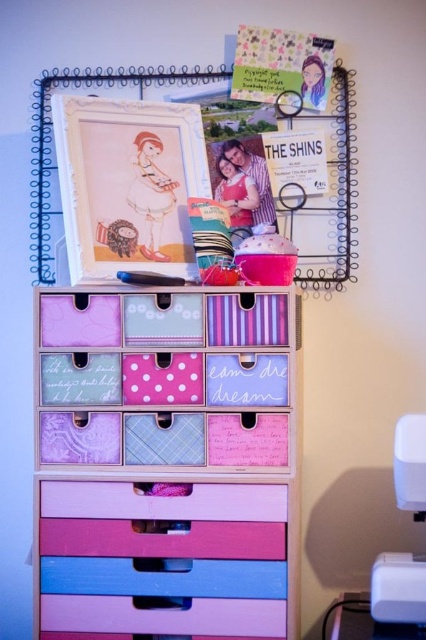
Question: Which of the following is the closest to the observer?

Choices:
 (A) (167, 422)
 (B) (412, 604)

Answer: (B)

Question: Can you confirm if pastel wood drawers at center is thinner than white plastic sewing machine at lower right?

Choices:
 (A) yes
 (B) no

Answer: (B)

Question: From the image, what is the correct spatial relationship of pastel wood drawers at center in relation to white plastic sewing machine at lower right?

Choices:
 (A) below
 (B) above

Answer: (B)

Question: Among these objects, which one is nearest to the camera?

Choices:
 (A) pastel wood drawers at center
 (B) white plastic sewing machine at lower right

Answer: (B)

Question: From the image, what is the correct spatial relationship of pastel wood drawers at center in relation to white plastic sewing machine at lower right?

Choices:
 (A) below
 (B) above

Answer: (B)

Question: Which of the following is the farthest from the observer?

Choices:
 (A) (408, 460)
 (B) (273, 452)

Answer: (B)